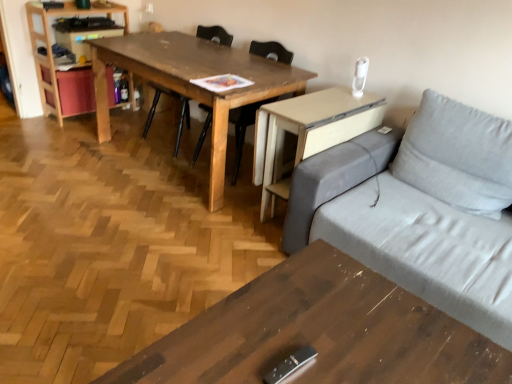
Question: Considering the positions of point (148, 114) and point (208, 49), is point (148, 114) closer or farther from the camera than point (208, 49)?

Choices:
 (A) farther
 (B) closer

Answer: (A)

Question: From a real-world perspective, relative to wooden table at center, acting as the first table starting from the back, is wooden chair at center, the second chair in the right-to-left sequence, vertically above or below?

Choices:
 (A) below
 (B) above

Answer: (B)

Question: Which of these objects is positioned farthest from the wooden table at center, the second table in the front-to-back sequence?

Choices:
 (A) light wood bookshelf at left
 (B) wooden chair at center, the second chair in the right-to-left sequence
 (C) wooden chair at center, which ranks as the first chair in right-to-left order
 (D) wooden coffee table at lower center, the first table from the bottom
 (E) beige wood computer desk at right

Answer: (D)

Question: Which object is the closest to the wooden chair at center, acting as the 2th chair starting from the left?

Choices:
 (A) wooden chair at center, the first chair when ordered from left to right
 (B) wooden table at center, the second table in the front-to-back sequence
 (C) beige wood computer desk at right
 (D) wooden coffee table at lower center, which ranks as the 2th table in top-to-bottom order
 (E) light wood bookshelf at left

Answer: (A)